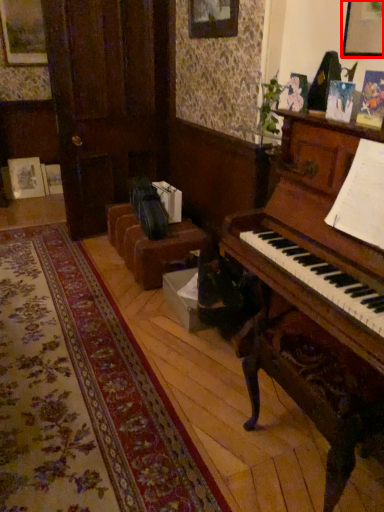
Question: Observing the image, what is the correct spatial positioning of picture frame (annotated by the red box) in reference to furniture?

Choices:
 (A) right
 (B) left

Answer: (A)